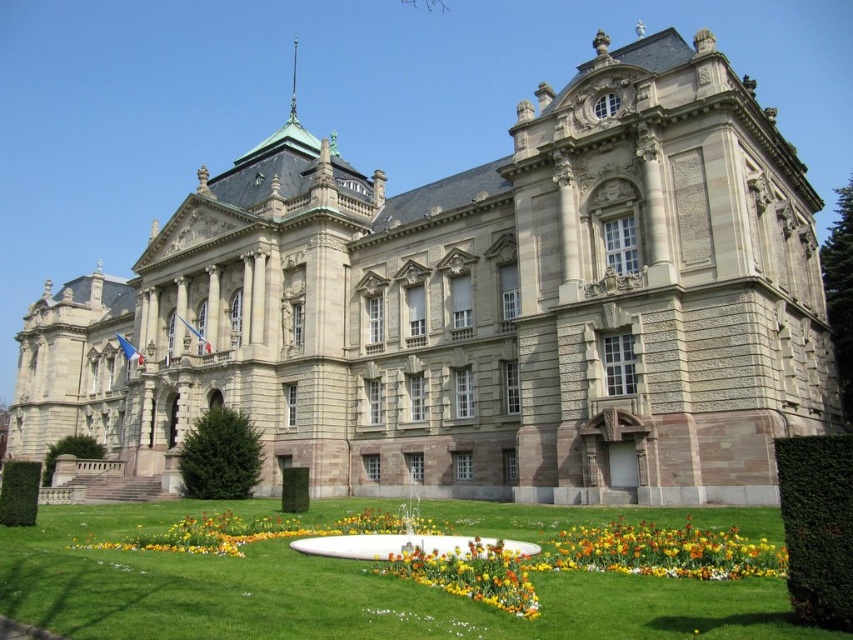
Is green grass at center to the left of multicolored fabric flower bed at center from the viewer's perspective?

Yes, green grass at center is to the left of multicolored fabric flower bed at center.

Is green grass at center below multicolored fabric flower bed at center?

Indeed, green grass at center is positioned under multicolored fabric flower bed at center.

Is point (97, 572) farther from camera compared to point (462, 579)?

Yes, point (97, 572) is farther from viewer.

Where is `green grass at center`? green grass at center is located at coordinates (335, 593).

Who is more distant from viewer, (267, 541) or (614, 554)?

The point (267, 541) is more distant.

Is green grass at center smaller than vibrant multicolored petals at lower center?

No, green grass at center is not smaller than vibrant multicolored petals at lower center.

At what (x,y) coordinates should I click in order to perform the action: click on green grass at center. Please return your answer as a coordinate pair (x, y). Image resolution: width=853 pixels, height=640 pixels. Looking at the image, I should click on (335, 593).

Is vibrant multicolored petals at lower center bigger than multicolored fabric flower bed at center?

Indeed, vibrant multicolored petals at lower center has a larger size compared to multicolored fabric flower bed at center.

Who is positioned more to the right, vibrant multicolored petals at lower center or multicolored fabric flower bed at center?

vibrant multicolored petals at lower center is more to the right.

Image resolution: width=853 pixels, height=640 pixels. What are the coordinates of `vibrant multicolored petals at lower center` in the screenshot? It's located at (662, 552).

At what (x,y) coordinates should I click in order to perform the action: click on vibrant multicolored petals at lower center. Please return your answer as a coordinate pair (x, y). The height and width of the screenshot is (640, 853). Looking at the image, I should click on (662, 552).